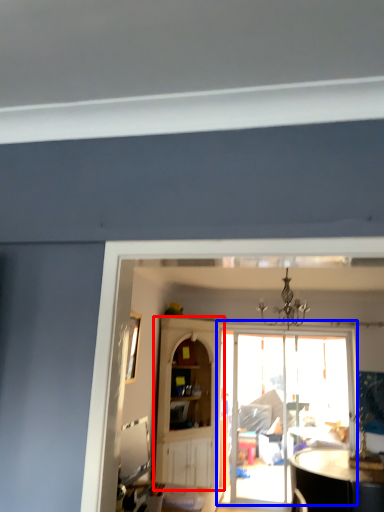
Question: Which of the following is the farthest to the observer, cabinetry (highlighted by a red box) or door (highlighted by a blue box)?

Choices:
 (A) cabinetry
 (B) door

Answer: (B)